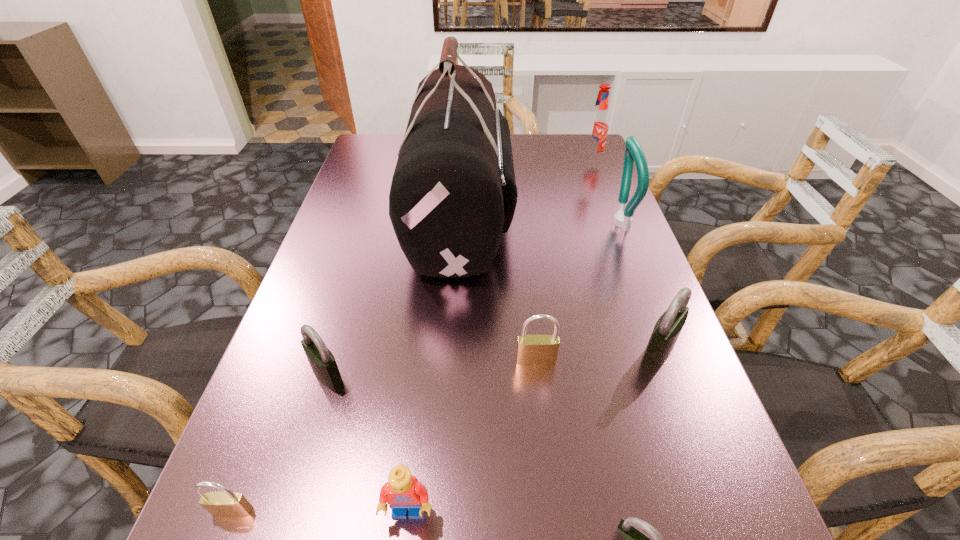
Where is `Lego`? The width and height of the screenshot is (960, 540). Lego is located at coordinates point(402,492).

The height and width of the screenshot is (540, 960). In order to click on the leftmost object in this screenshot , I will do click(x=228, y=504).

Image resolution: width=960 pixels, height=540 pixels. In order to click on the left brass padlock in this screenshot , I will do `click(228, 504)`.

Find the location of a particular element. vacant space located on the front pocket of the tallest object is located at coordinates click(579, 208).

I want to click on blank area located 0.380m on the left of the red root beer, so click(x=453, y=161).

Find the location of a particular element. This screenshot has height=540, width=960. vacant space located at the jaws of the bottle opener is located at coordinates (587, 223).

You are a GUI agent. You are given a task and a screenshot of the screen. Output one action in this format:
    pyautogui.click(x=<x>, y=<y>)
    Task: Click on the blank area located at the jaws of the bottle opener
    
    Given the screenshot: What is the action you would take?
    pyautogui.click(x=468, y=223)

What are the coordinates of `vacant space situated at the jaws of the bottle opener` in the screenshot? It's located at (566, 223).

This screenshot has height=540, width=960. What are the coordinates of `free space located 0.310m on the left of the fourth tallest object` in the screenshot? It's located at (466, 351).

The width and height of the screenshot is (960, 540). I want to click on vacant position located on the right of the leftmost black padlock, so click(375, 374).